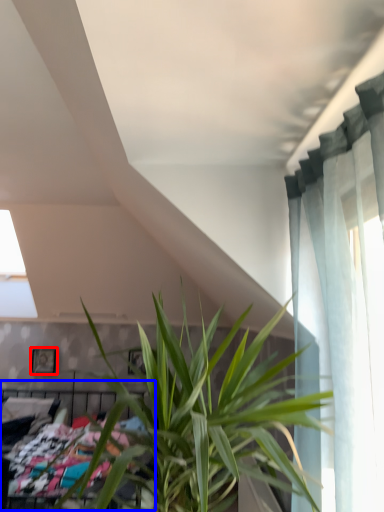
Question: Which point is closer to the camera, picture frame (highlighted by a red box) or bed (highlighted by a blue box)?

Choices:
 (A) picture frame
 (B) bed

Answer: (B)